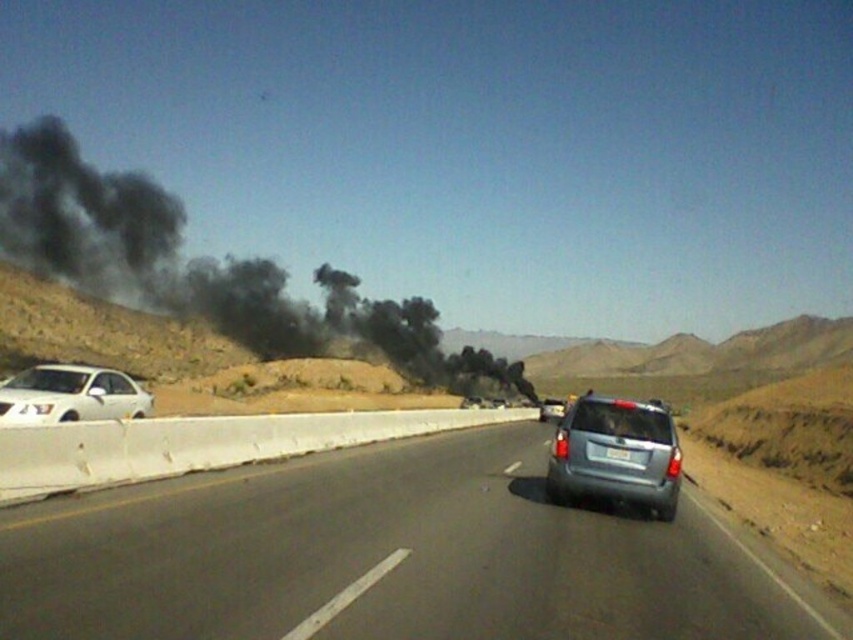
Which of these two, satin silver suv at center or white glossy sedan at left, stands taller?

With more height is white glossy sedan at left.

Does satin silver suv at center have a lesser width compared to white glossy sedan at left?

Indeed, satin silver suv at center has a lesser width compared to white glossy sedan at left.

Find the location of a particular element. satin silver suv at center is located at coordinates (616, 460).

Measure the distance between point (599,404) and camera.

Point (599,404) and camera are 11.92 meters apart from each other.

Does satin silver suv at center appear on the left side of white plastic license plate at rear?

Yes, satin silver suv at center is to the left of white plastic license plate at rear.

Based on the photo, who is more distant from viewer, (654, 464) or (622, 458)?

The point (622, 458) is more distant.

At what (x,y) coordinates should I click in order to perform the action: click on satin silver suv at center. Please return your answer as a coordinate pair (x, y). Looking at the image, I should click on (616, 460).

Based on the photo, between black smoke at left and white glossy sedan at left, which one appears on the left side from the viewer's perspective?

black smoke at left

Does black smoke at left have a lesser height compared to white glossy sedan at left?

No.

Describe the element at coordinates (202, 266) in the screenshot. The width and height of the screenshot is (853, 640). I see `black smoke at left` at that location.

Find the location of `black smoke at left`. black smoke at left is located at coordinates pos(202,266).